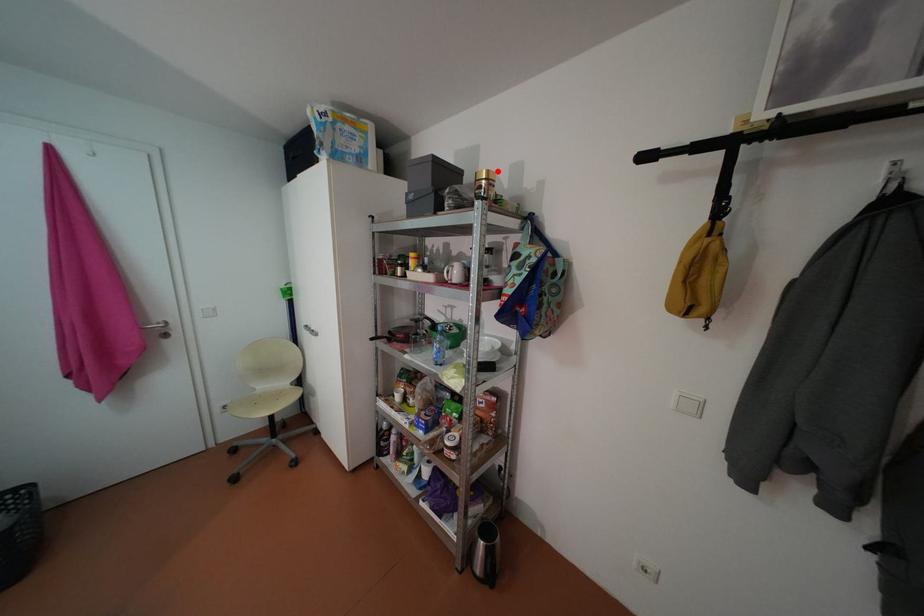
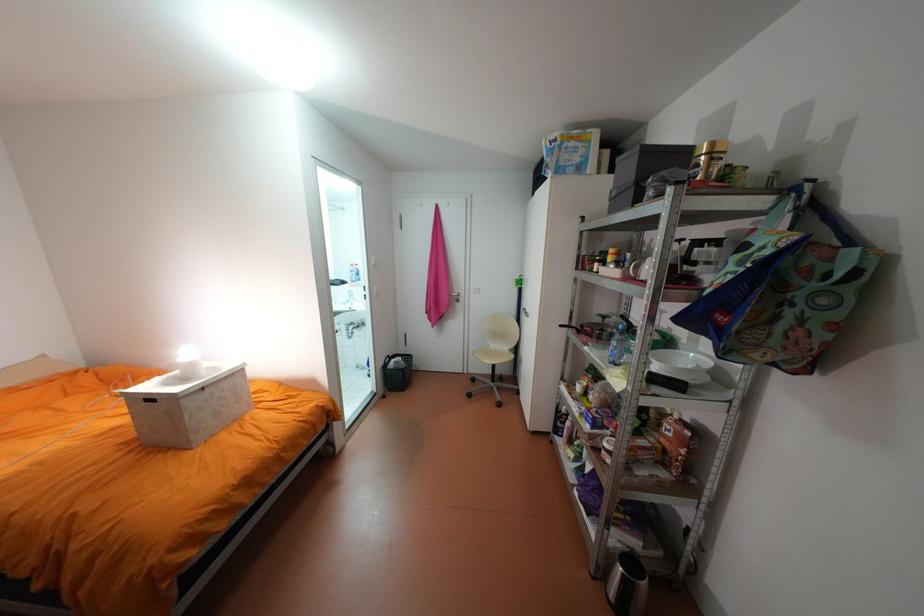
Locate, in the second image, the point that corresponds to the highlighted location in the first image.

(722, 143)